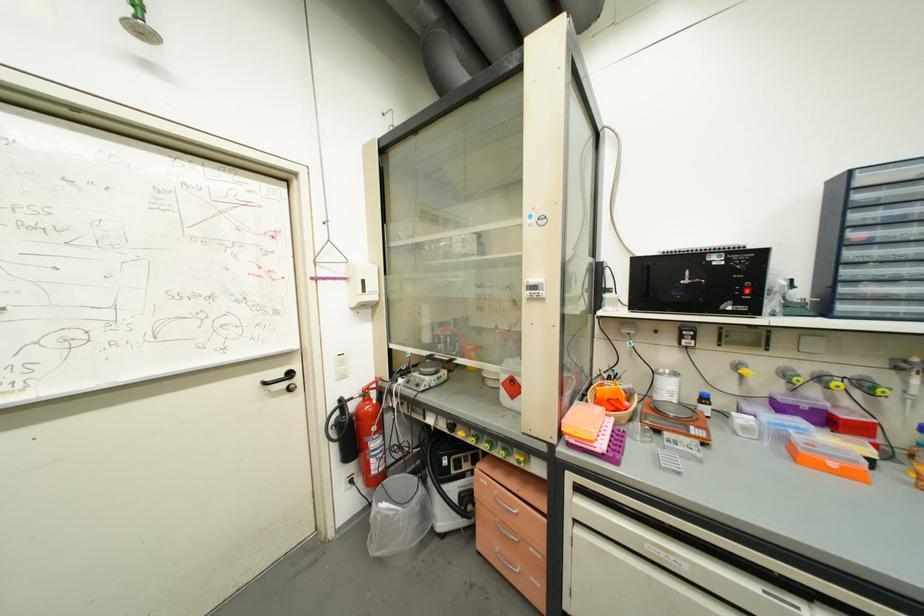
Find the location of a particular element. The width and height of the screenshot is (924, 616). red power button is located at coordinates (746, 289).